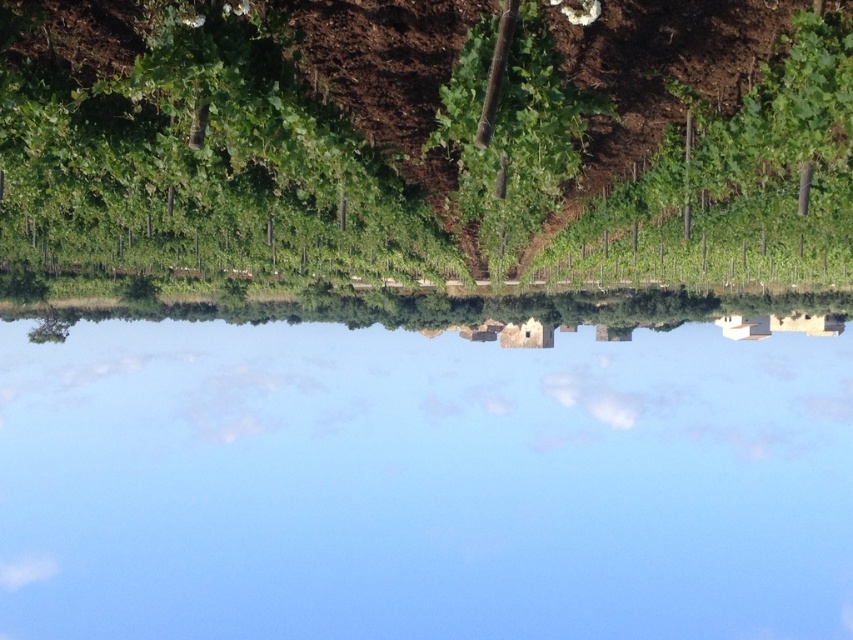
Consider the image. You are an architect designing a new vineyard and are looking at this image for inspiration. You notice the blue sky at upper center and the green leafy plant at center. Which object is located above the other?

The blue sky at upper center is positioned under the green leafy plant at center, so the green leafy plant at center is above the blue sky at upper center.

You are a photographer planning to capture the blue sky at upper center and the green leafy plant at center in a single frame. Considering their height differences, which object should you focus on first to ensure both are in the frame?

The blue sky at upper center is much taller than the green leafy plant at center, so you should focus on the blue sky at upper center first to ensure both are in the frame.